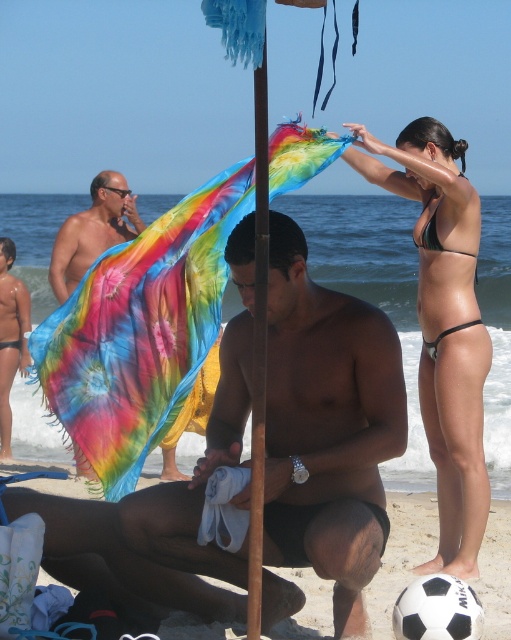
You are a photographer trying to capture the perfect shot of the smooth tan skin at center. Based on the coordinates provided in the Objects Description, where should you position your camera to ensure the subject is centered in the frame?

The smooth tan skin at center is located at coordinates point (328, 428), so positioning the camera to center the frame at those coordinates will ensure the subject is centered.

You are a photographer at the beach scene. You want to take a photo of the green and black bikini at upper right. Where should you aim your camera to capture it?

You should aim your camera at point (444, 324) to capture the green and black bikini at upper right.

What is located at the coordinates point (328, 428) in the image?

The point (328, 428) indicates smooth tan skin at center.